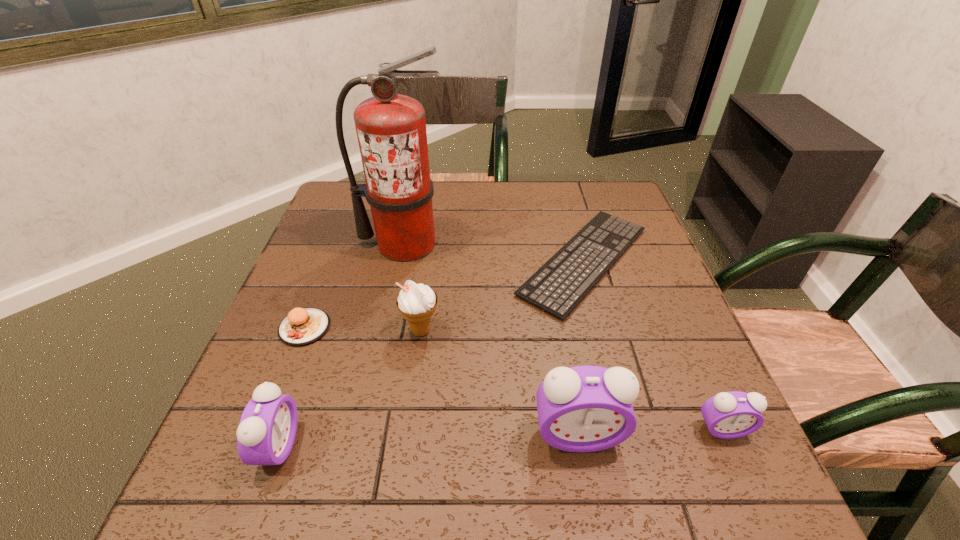
Identify the location of free spot located toward the nozzle of the fire extinguisher. (393, 300).

Image resolution: width=960 pixels, height=540 pixels. What are the coordinates of `vacant position located 0.160m on the front of the shortest object` in the screenshot? It's located at (617, 384).

You are a GUI agent. You are given a task and a screenshot of the screen. Output one action in this format:
    pyautogui.click(x=<x>, y=<y>)
    Task: Click on the vacant space positioned on the right of the sixth tallest object
    The image size is (960, 540).
    Given the screenshot: What is the action you would take?
    pyautogui.click(x=444, y=328)

Locate an element on the screen. vacant space located 0.110m on the right of the icecream is located at coordinates (491, 330).

At what (x,y) coordinates should I click in order to perform the action: click on object that is at the far edge. Please return your answer as a coordinate pair (x, y). Looking at the image, I should click on (585, 266).

Locate an element on the screen. This screenshot has height=540, width=960. alarm clock at the left edge is located at coordinates (266, 433).

Locate an element on the screen. The width and height of the screenshot is (960, 540). fire extinguisher present at the left edge is located at coordinates (391, 128).

Where is `patty positioned at the left edge`? This screenshot has width=960, height=540. patty positioned at the left edge is located at coordinates (303, 326).

The height and width of the screenshot is (540, 960). Find the location of `alarm clock situated at the right edge`. alarm clock situated at the right edge is located at coordinates (728, 415).

At what (x,y) coordinates should I click in order to perform the action: click on computer keyboard that is at the right edge. Please return your answer as a coordinate pair (x, y). The height and width of the screenshot is (540, 960). Looking at the image, I should click on (585, 266).